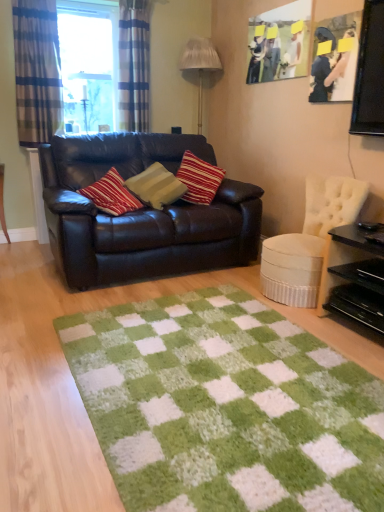
Question: Is matte black couch at center facing away from striped fabric pillow at center?

Choices:
 (A) yes
 (B) no

Answer: (A)

Question: Considering the relative sizes of matte black couch at center and striped fabric pillow at center in the image provided, is matte black couch at center wider than striped fabric pillow at center?

Choices:
 (A) no
 (B) yes

Answer: (B)

Question: Does matte black couch at center come behind striped fabric pillow at center?

Choices:
 (A) no
 (B) yes

Answer: (A)

Question: Is matte black couch at center shorter than striped fabric pillow at center?

Choices:
 (A) no
 (B) yes

Answer: (A)

Question: Considering the relative positions of matte black couch at center and striped fabric pillow at center in the image provided, is matte black couch at center to the right of striped fabric pillow at center from the viewer's perspective?

Choices:
 (A) no
 (B) yes

Answer: (A)

Question: From their relative heights in the image, would you say plaid fabric curtain at left, which is the first curtain in left-to-right order, is taller or shorter than blue plaid curtain at upper left, the 2th curtain positioned from the left?

Choices:
 (A) short
 (B) tall

Answer: (B)

Question: From the image's perspective, is plaid fabric curtain at left, acting as the second curtain starting from the right, above or below blue plaid curtain at upper left, marked as the 1th curtain in a right-to-left arrangement?

Choices:
 (A) below
 (B) above

Answer: (A)

Question: From a real-world perspective, is plaid fabric curtain at left, acting as the second curtain starting from the right, positioned above or below blue plaid curtain at upper left, marked as the 1th curtain in a right-to-left arrangement?

Choices:
 (A) above
 (B) below

Answer: (B)

Question: Is point (23, 84) closer or farther from the camera than point (135, 58)?

Choices:
 (A) closer
 (B) farther

Answer: (A)

Question: In terms of width, does green shaggy rug at center look wider or thinner when compared to clear glass window at upper left?

Choices:
 (A) thin
 (B) wide

Answer: (B)

Question: Is green shaggy rug at center taller or shorter than clear glass window at upper left?

Choices:
 (A) short
 (B) tall

Answer: (A)

Question: From a real-world perspective, is green shaggy rug at center physically located above or below clear glass window at upper left?

Choices:
 (A) below
 (B) above

Answer: (A)

Question: Is point (175, 333) closer or farther from the camera than point (92, 16)?

Choices:
 (A) farther
 (B) closer

Answer: (B)

Question: Considering the positions of black glossy table at right and matte wooden picture frame at upper right, which ranks as the second picture frame in front-to-back order, in the image, is black glossy table at right bigger or smaller than matte wooden picture frame at upper right, which ranks as the second picture frame in front-to-back order,?

Choices:
 (A) small
 (B) big

Answer: (B)

Question: Is black glossy table at right situated inside matte wooden picture frame at upper right, which ranks as the 1th picture frame in left-to-right order, or outside?

Choices:
 (A) outside
 (B) inside

Answer: (A)